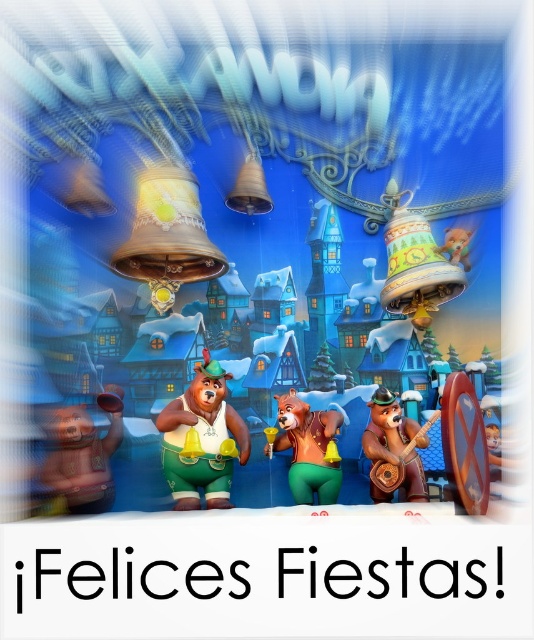
Does green matte bear at center come behind matte gold bear at lower left?

That is True.

Does green matte bear at center appear over matte gold bear at lower left?

Correct, green matte bear at center is located above matte gold bear at lower left.

The height and width of the screenshot is (640, 534). What do you see at coordinates (201, 438) in the screenshot? I see `green matte bear at center` at bounding box center [201, 438].

Identify the location of green matte bear at center. (201, 438).

Between green matte bear at center and shiny gold bear at center, which one appears on the left side from the viewer's perspective?

Positioned to the left is green matte bear at center.

This screenshot has height=640, width=534. I want to click on green matte bear at center, so click(201, 438).

Is point (185, 490) less distant than point (299, 444)?

Yes, it is.

I want to click on green matte bear at center, so click(x=201, y=438).

Who is positioned more to the left, green matte bear at center or wooden guitar at center?

green matte bear at center

Is the position of green matte bear at center more distant than that of wooden guitar at center?

No, green matte bear at center is closer to the viewer.

Is point (206, 349) closer to viewer compared to point (406, 470)?

No, (206, 349) is further to viewer.

You are a GUI agent. You are given a task and a screenshot of the screen. Output one action in this format:
    pyautogui.click(x=<x>, y=<y>)
    Task: Click on the green matte bear at center
    This screenshot has width=534, height=640.
    Given the screenshot: What is the action you would take?
    pyautogui.click(x=201, y=438)